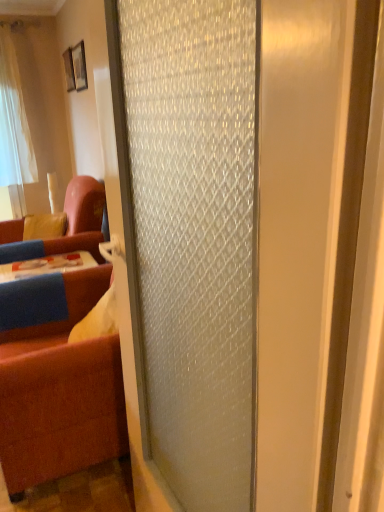
Question: Considering the positions of velvet blue couch at left, acting as the first studio couch starting from the back, and brown fabric studio couch at left, which is counted as the 1th studio couch, starting from the front, in the image, is velvet blue couch at left, acting as the first studio couch starting from the back, wider or thinner than brown fabric studio couch at left, which is counted as the 1th studio couch, starting from the front,?

Choices:
 (A) wide
 (B) thin

Answer: (A)

Question: Considering their positions, is velvet blue couch at left, which is counted as the 2th studio couch, starting from the front, located in front of or behind brown fabric studio couch at left, the second studio couch in the back-to-front sequence?

Choices:
 (A) front
 (B) behind

Answer: (B)

Question: Which object is the closest to the brown fabric studio couch at left, the second studio couch in the back-to-front sequence?

Choices:
 (A) wooden picture frame at upper left, which ranks as the 1th picture frame in left-to-right order
 (B) yellow fabric pillow at left
 (C) frosted glass door at center
 (D) wooden picture frame at upper left, arranged as the second picture frame when viewed from the left
 (E) velvet blue couch at left, which is counted as the 2th studio couch, starting from the front

Answer: (C)

Question: Estimate the real-world distances between objects in this image. Which object is closer to the velvet blue couch at left, acting as the first studio couch starting from the back?

Choices:
 (A) brown fabric studio couch at left, the second studio couch in the back-to-front sequence
 (B) wooden picture frame at upper left, marked as the 1th picture frame in a front-to-back arrangement
 (C) frosted glass door at center
 (D) wooden picture frame at upper left, arranged as the first picture frame when viewed from the back
 (E) yellow fabric pillow at left

Answer: (E)